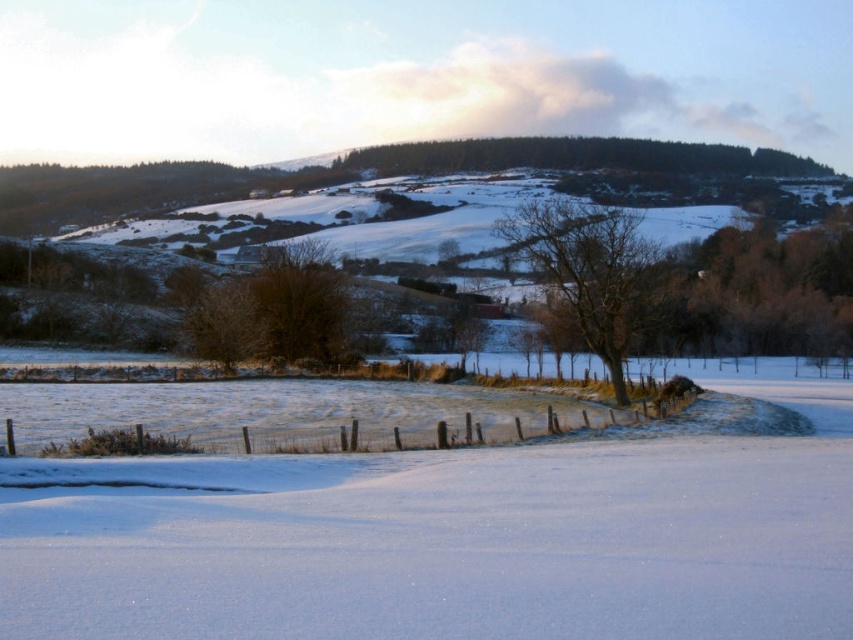
You are standing at the point where the wire fence starts curving to the right. From your position, which direction would you face to look directly at the bare wood tree at center represented by point (593, 272)?

The bare wood tree at center is located at point (593, 272), so you should face towards the center of the image to look directly at it.

You are standing at the point marked by the coordinates point (460, 540) in the image. What is the surface texture you are currently standing on?

The point (460, 540) indicates white powdery snow at center, so the surface texture is powdery snow.

You are an observer standing in the winter landscape. You notice the white powdery snow at center and the wooden fence at center. Which object is positioned higher from the ground?

The white powdery snow at center is located above the wooden fence at center, so it is positioned higher from the ground.